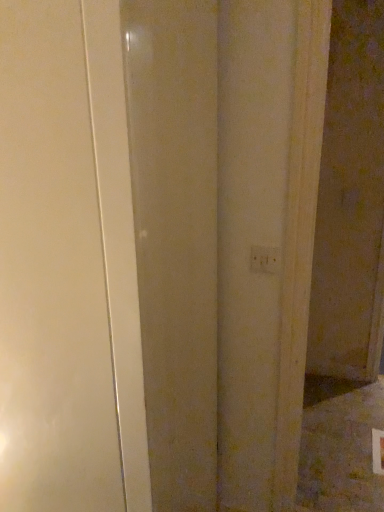
The width and height of the screenshot is (384, 512). What do you see at coordinates (265, 259) in the screenshot? I see `matte white electric outlet at center` at bounding box center [265, 259].

This screenshot has height=512, width=384. I want to click on matte white electric outlet at center, so click(x=265, y=259).

The image size is (384, 512). I want to click on matte white electric outlet at center, so click(265, 259).